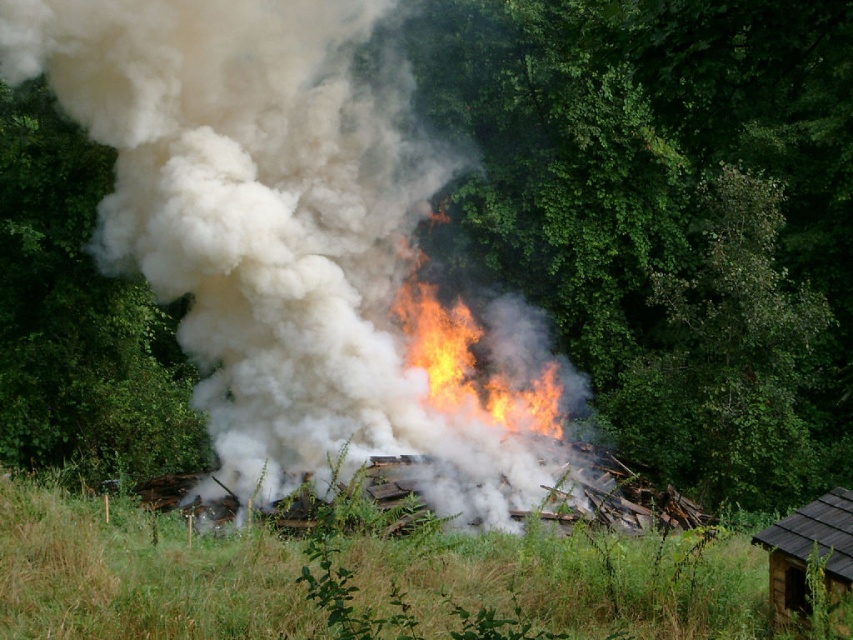
Question: Observing the image, what is the correct spatial positioning of green leafy tree at left in reference to brown wooden hut at lower right?

Choices:
 (A) left
 (B) right

Answer: (A)

Question: Based on their relative distances, which object is farther from the green leafy tree at left?

Choices:
 (A) green leafy tree at center
 (B) flaming debris at center
 (C) green grass at lower center

Answer: (C)

Question: Does green leafy tree at left have a smaller size compared to brown wooden hut at lower right?

Choices:
 (A) yes
 (B) no

Answer: (A)

Question: Which point is closer to the camera?

Choices:
 (A) (65, 348)
 (B) (770, 412)

Answer: (B)

Question: Is flaming debris at center to the left of brown wooden hut at lower right from the viewer's perspective?

Choices:
 (A) no
 (B) yes

Answer: (B)

Question: Which point appears closest to the camera in this image?

Choices:
 (A) (48, 164)
 (B) (837, 563)

Answer: (B)